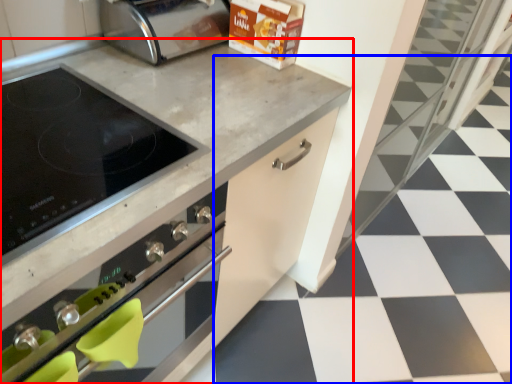
Question: Which object appears farthest to the camera in this image, countertop (highlighted by a red box) or tile (highlighted by a blue box)?

Choices:
 (A) countertop
 (B) tile

Answer: (B)